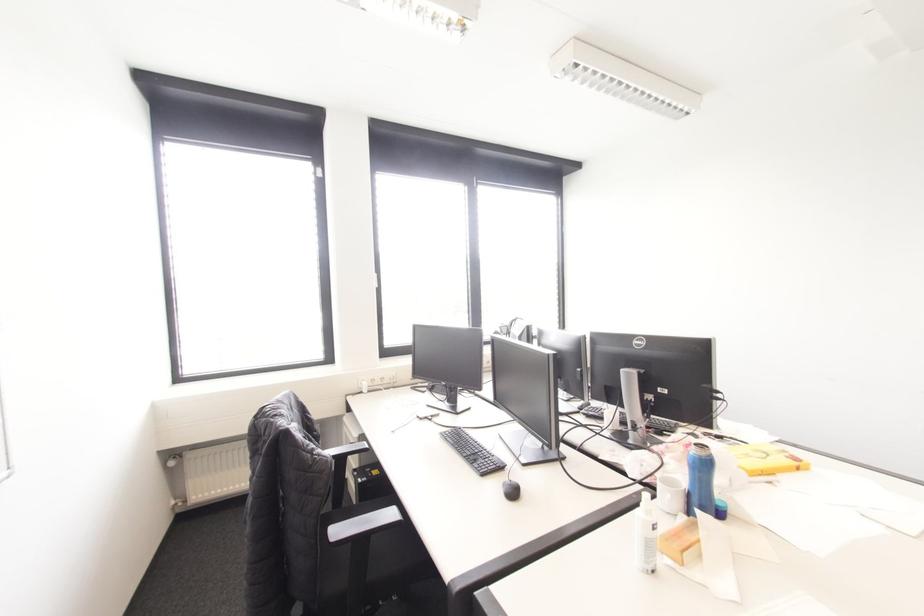
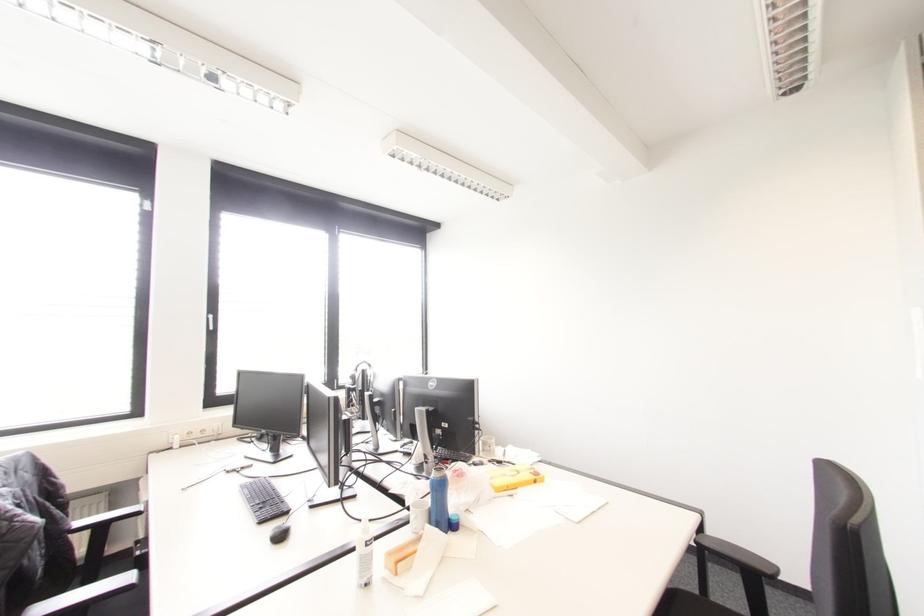
Locate, in the second image, the point that corresponds to point 650,546 in the first image.

(365, 562)